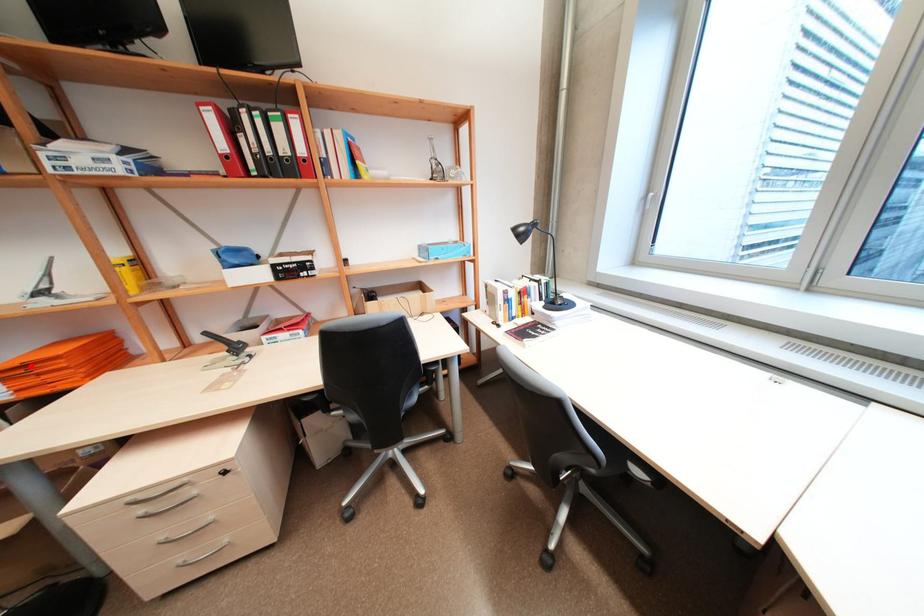
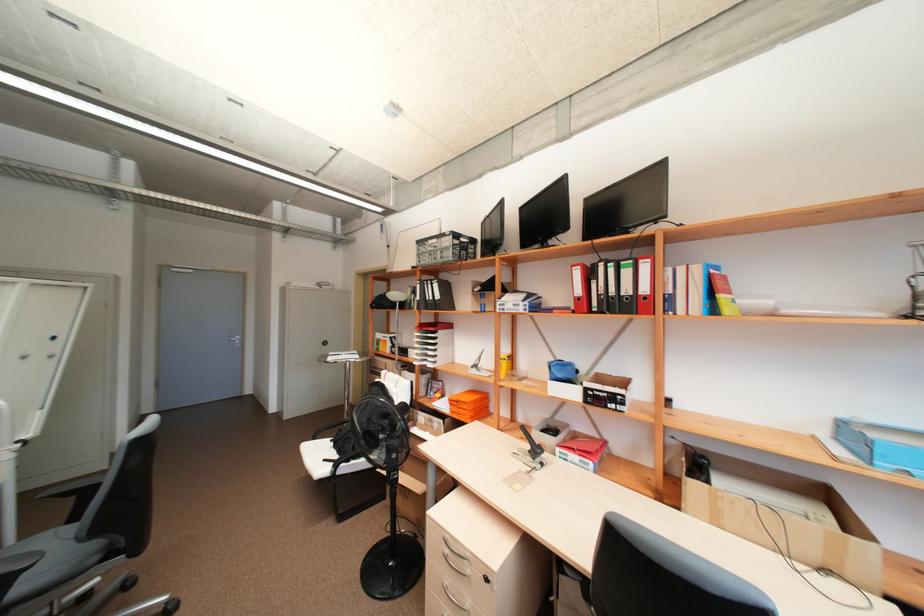
Question: I am providing you with two images of the same scene from different viewpoints. A red point is shown in image1. For the corresponding object point in image2, is it positioned nearer or farther from the camera?

Choices:
 (A) Nearer
 (B) Farther

Answer: (B)